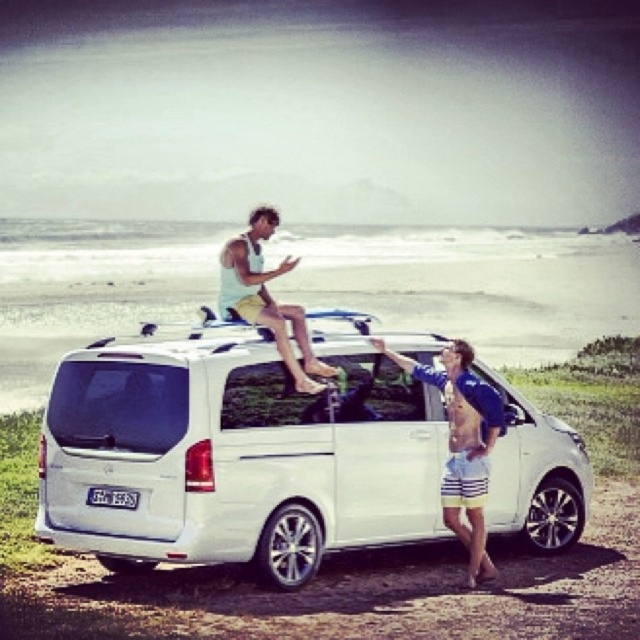
You are planning to load two surfboards onto the roof rack of the white van. The first surfboard is the white matte surfboard at upper center, and the second is the matte white surfboard at upper center. Can both surfboards fit on the roof rack without overlapping?

The white matte surfboard at upper center is positioned under the matte white surfboard at upper center, which means they are already overlapping. Therefore, both surfboards cannot fit on the roof rack without overlapping.

You are a photographer trying to capture the white matte van at center and the matte white surfboard at upper center in a single shot. Based on their positions, which object should you position closer to the left side of your camera frame to include both in the photo?

The white matte van at center is to the right of the matte white surfboard at upper center, so to include both in the photo, position the surfboard closer to the left side of the frame so the van can be on the right.